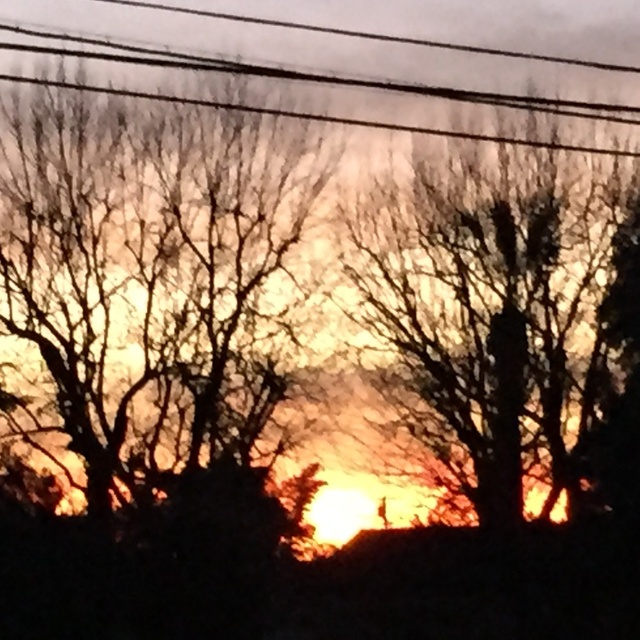
Question: Based on their relative distances, which object is nearer to the silhouette bark tree at center?

Choices:
 (A) silhouette bare tree at center
 (B) black wire at upper center

Answer: (A)

Question: Considering the relative positions of silhouette bark tree at center and silhouette bare tree at center in the image provided, where is silhouette bark tree at center located with respect to silhouette bare tree at center?

Choices:
 (A) below
 (B) above

Answer: (B)

Question: Based on their relative distances, which object is farther from the silhouette bark tree at center?

Choices:
 (A) black wire at upper center
 (B) silhouette bare tree at center

Answer: (A)

Question: Considering the relative positions of silhouette bark tree at center and black wire at upper center in the image provided, where is silhouette bark tree at center located with respect to black wire at upper center?

Choices:
 (A) right
 (B) left

Answer: (B)

Question: Does silhouette bark tree at center appear under silhouette bare tree at center?

Choices:
 (A) no
 (B) yes

Answer: (A)

Question: Which point is farther from the camera taking this photo?

Choices:
 (A) (509, 51)
 (B) (419, 384)

Answer: (B)